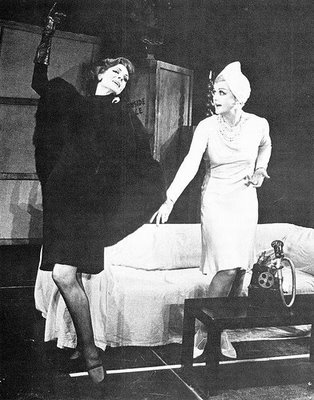
Locate an element on the screen. This screenshot has height=400, width=314. white line under table is located at coordinates (260, 360), (196, 363), (125, 368), (78, 375).